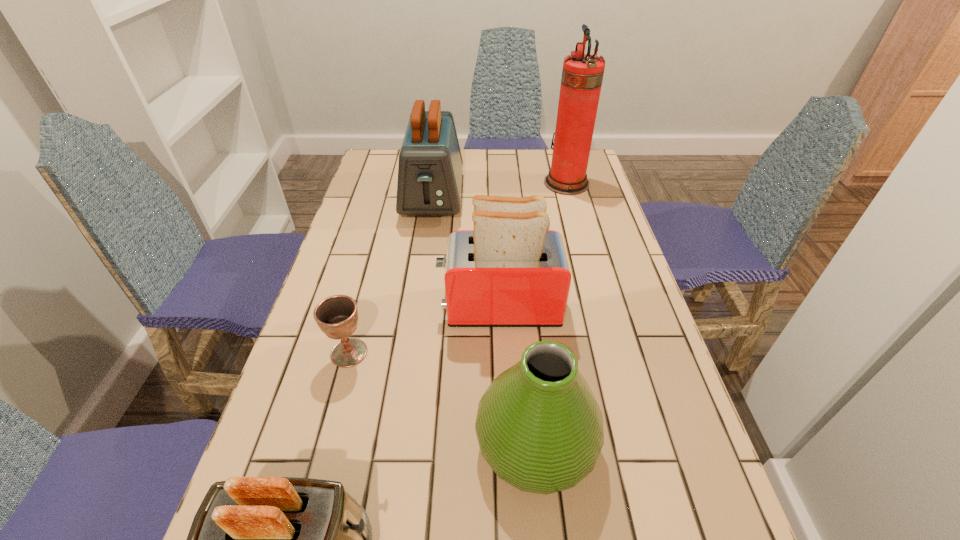
I want to click on free space located on the front-facing side of the second nearest toaster, so click(x=327, y=307).

Identify the location of free spot located 0.070m on the front-facing side of the second nearest toaster. The image size is (960, 540). (412, 307).

You are a GUI agent. You are given a task and a screenshot of the screen. Output one action in this format:
    pyautogui.click(x=<x>, y=<y>)
    Task: Click on the vacant space situated on the front-facing side of the second nearest toaster
    The image size is (960, 540).
    Given the screenshot: What is the action you would take?
    (408, 307)

This screenshot has height=540, width=960. Find the location of `blank space located on the back of the vase`. blank space located on the back of the vase is located at coordinates (520, 282).

Find the location of a particular element. The width and height of the screenshot is (960, 540). vacant space located on the front of the fourth farthest object is located at coordinates click(318, 470).

The image size is (960, 540). I want to click on fire extinguisher at the far edge, so click(x=582, y=75).

The width and height of the screenshot is (960, 540). Identify the location of toaster that is at the far edge. pyautogui.click(x=430, y=166).

You are a GUI agent. You are given a task and a screenshot of the screen. Output one action in this format:
    pyautogui.click(x=<x>, y=<y>)
    Task: Click on the toaster located in the left edge section of the desktop
    
    Given the screenshot: What is the action you would take?
    pyautogui.click(x=430, y=166)

I want to click on chalice positioned at the left edge, so tap(337, 316).

Find the location of a particular element. This screenshot has height=540, width=960. object that is at the right edge is located at coordinates (582, 75).